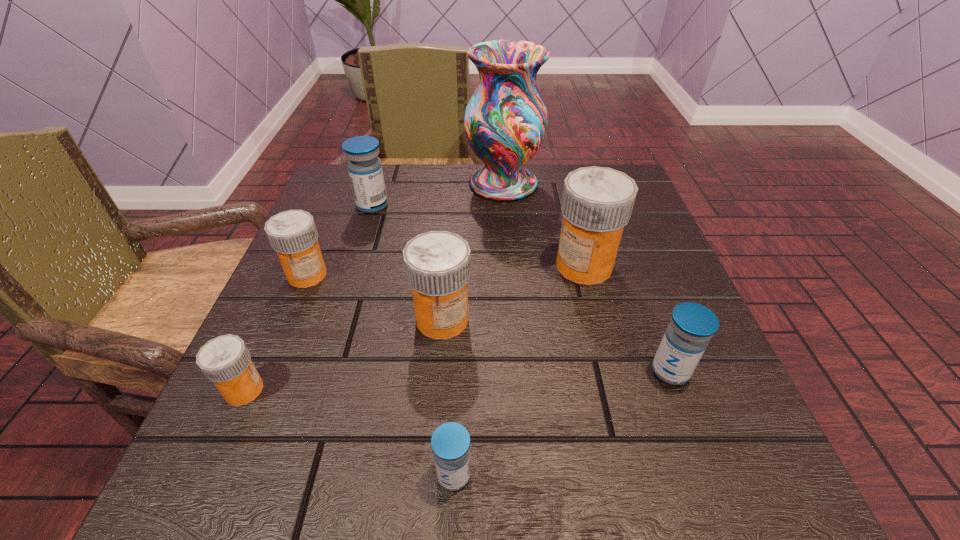
This screenshot has width=960, height=540. I want to click on free point located on the back of the rightmost blue medicine, so click(x=647, y=308).

Identify the location of free space located 0.120m on the label side of the smallest orange medicine. Image resolution: width=960 pixels, height=540 pixels. (346, 390).

Locate an element on the screen. vacant region located on the right of the nearest blue medicine is located at coordinates (765, 475).

Locate an element on the screen. Image resolution: width=960 pixels, height=540 pixels. vase that is at the far edge is located at coordinates (505, 121).

Identify the location of medicine at the far edge. The image size is (960, 540). (365, 170).

The width and height of the screenshot is (960, 540). Identify the location of object situated at the near edge. (450, 442).

Where is `object positioned at the far left corner`? Image resolution: width=960 pixels, height=540 pixels. object positioned at the far left corner is located at coordinates (365, 170).

I want to click on vacant position at the far edge of the desktop, so click(559, 208).

Where is `vacant position at the near edge of the desktop`? The image size is (960, 540). vacant position at the near edge of the desktop is located at coordinates (493, 474).

This screenshot has height=540, width=960. In the image, there is a desktop. Identify the location of vacant region at the left edge. (337, 366).